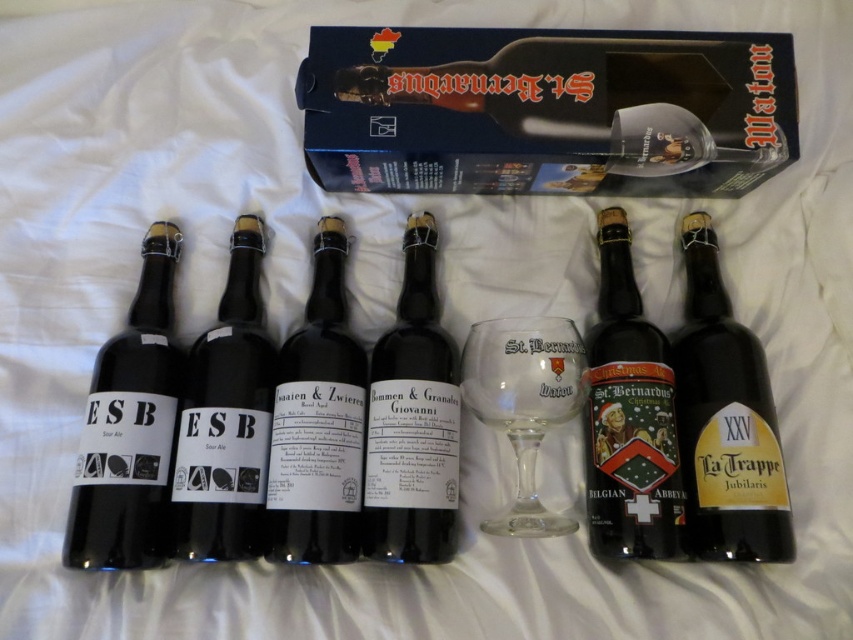
Question: Which object is closer to the camera taking this photo?

Choices:
 (A) transparent glass wine glass at center
 (B) dark brown glass bottle at center

Answer: (B)

Question: Is matte black bottle at center above transparent glass wine glass at center?

Choices:
 (A) yes
 (B) no

Answer: (A)

Question: Can you confirm if matte black bottle at center is wider than dark brown glass bottle at center?

Choices:
 (A) no
 (B) yes

Answer: (A)

Question: Which point is closer to the camera?

Choices:
 (A) (643, 176)
 (B) (718, 333)

Answer: (B)

Question: Does black glass bottle at center have a greater width compared to dark brown glass bottle at center?

Choices:
 (A) yes
 (B) no

Answer: (B)

Question: Which point is closer to the camera?

Choices:
 (A) (608, 401)
 (B) (778, 444)

Answer: (B)